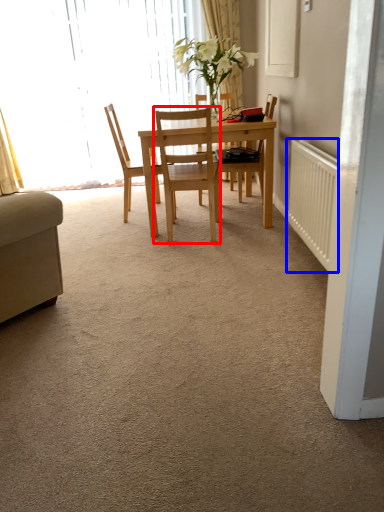
Question: Which object is further to the camera taking this photo, chair (highlighted by a red box) or radiator (highlighted by a blue box)?

Choices:
 (A) chair
 (B) radiator

Answer: (A)